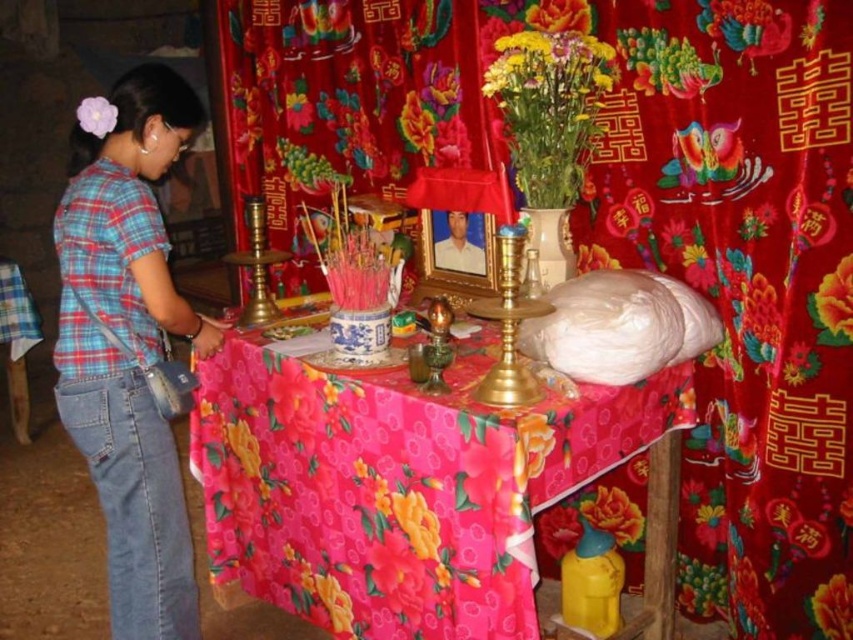
You are standing at the edge of the table and want to place a small offering on the floral fabric tablecloth at center. Based on the coordinates provided, can you determine if the point at (399, 484) is the correct location?

→ Yes, the point at (399, 484) corresponds to the floral fabric tablecloth at center, so placing the offering there would be correct.

You are a guest at a ceremony and need to place a 1.5 meter long ceremonial scroll on the table. The table has a floral fabric tablecloth at center. Is there enough space to lay the scroll flat on the tablecloth without folding it?

The distance between the objects on the table is 1.46 meters, which is slightly shorter than the 1.5 meter scroll. Therefore, there might not be enough space to lay the scroll flat without folding it.

You are a guest at a traditional ceremony and see the blue plaid shirt at left and the vibrant yellow bouquet at upper center on the table. Which item is located to the left of the other?

The blue plaid shirt at left is positioned on the left side of vibrant yellow bouquet at upper center, so the blue plaid shirt at left is to the left of the vibrant yellow bouquet at upper center.